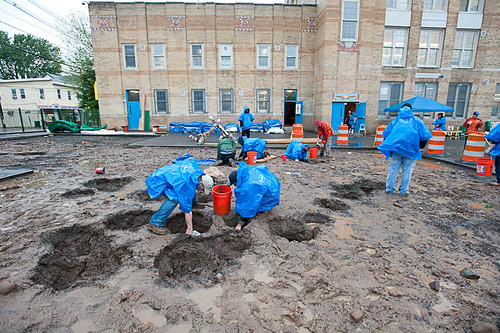
You are a GUI agent. You are given a task and a screenshot of the screen. Output one action in this format:
    pyautogui.click(x=<x>, y=<y>)
    Task: Click on the bucket
    The image size is (500, 333).
    Given the screenshot: What is the action you would take?
    pyautogui.click(x=225, y=198), pyautogui.click(x=251, y=154), pyautogui.click(x=317, y=152), pyautogui.click(x=486, y=163)